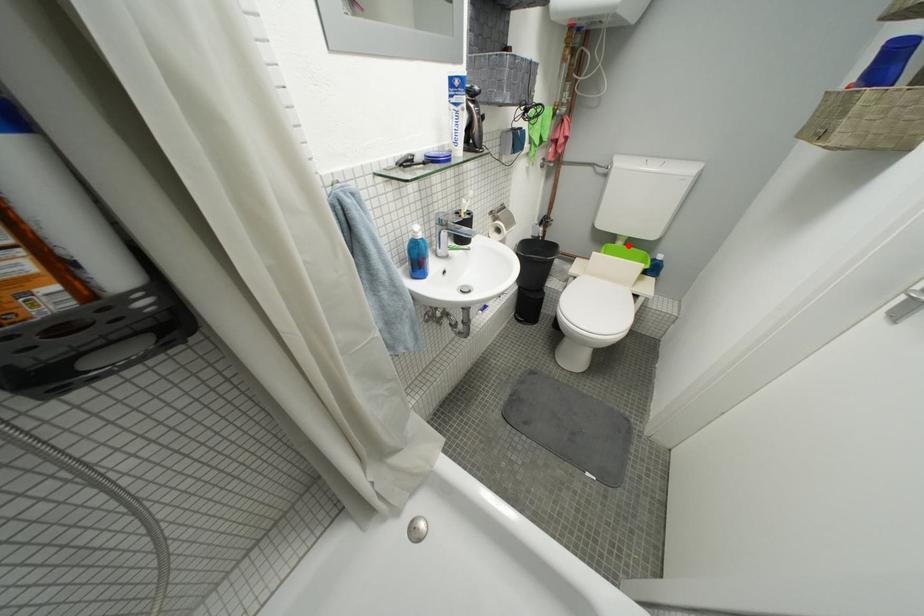
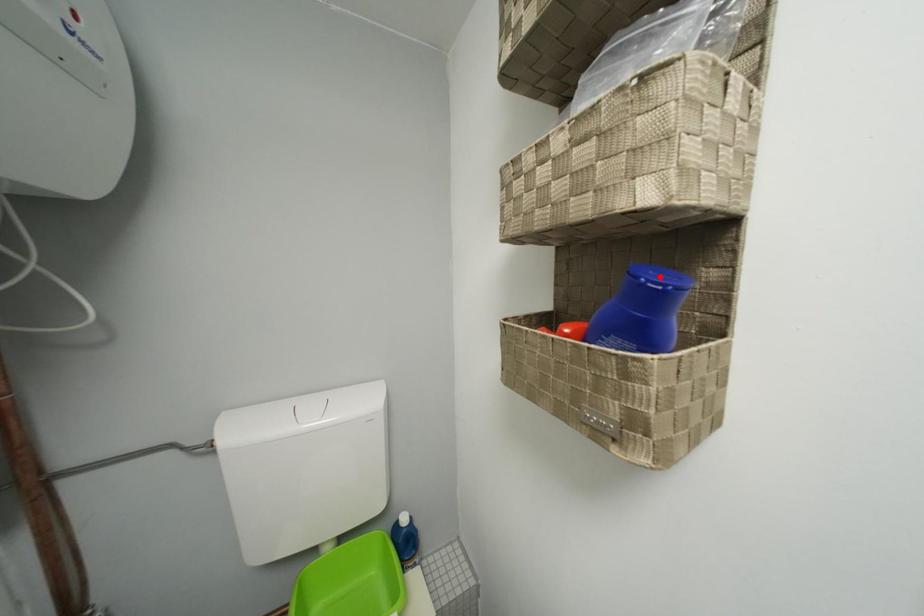
I am providing you with two images of the same scene from different viewpoints. A red point is marked on the first image and another point is marked on the second image. Does the point marked in image1 correspond to the same location as the one in image2?

No